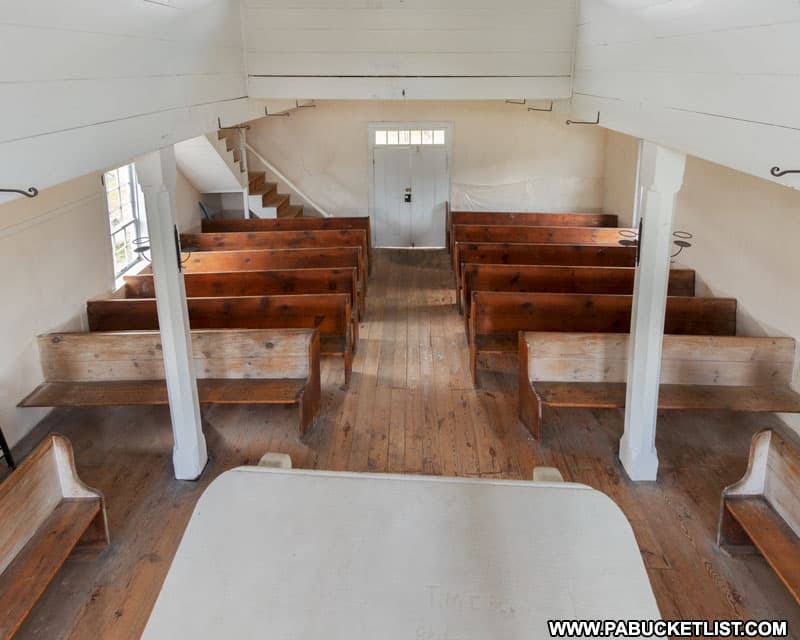
The image size is (800, 640). In order to click on window in this screenshot , I will do `click(122, 249)`, `click(380, 134)`, `click(390, 139)`, `click(402, 140)`, `click(418, 141)`, `click(429, 139)`, `click(438, 136)`, `click(116, 193)`.